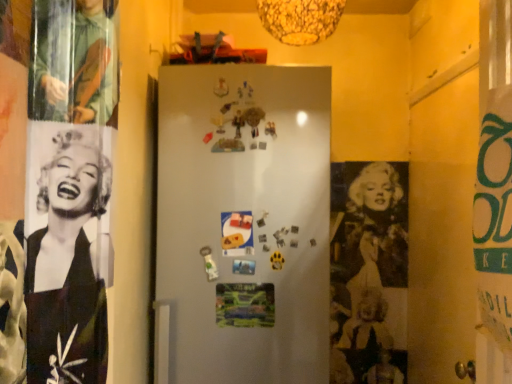
Measure the distance between matte paper poster at center, which is the 1th poster page from top to bottom, and camera.

matte paper poster at center, which is the 1th poster page from top to bottom, is 1.42 meters from camera.

Where is `matte paper poster at center, which is the 1th poster page from top to bottom`? This screenshot has width=512, height=384. matte paper poster at center, which is the 1th poster page from top to bottom is located at coordinates (237, 233).

Describe the element at coordinates (237, 233) in the screenshot. This screenshot has height=384, width=512. I see `matte paper poster at center, which is the 1th poster page from top to bottom` at that location.

Looking at this image, how much space does matte paper poster at center, arranged as the second poster page when ordered from the bottom, occupy vertically?

It is 5.87 inches.

Image resolution: width=512 pixels, height=384 pixels. Describe the element at coordinates (245, 304) in the screenshot. I see `metallic silver poster at center, positioned as the first poster page in bottom-to-top order` at that location.

Find the location of a particular element. metallic silver poster at center, positioned as the first poster page in bottom-to-top order is located at coordinates (245, 304).

The image size is (512, 384). I want to click on matte paper poster at center, which is the 1th poster page from top to bottom, so click(x=237, y=233).

Can you confirm if matte paper poster at center, arranged as the second poster page when ordered from the bottom, is positioned to the right of metallic silver poster at center, positioned as the first poster page in bottom-to-top order?

No.

Which object is closer to the camera, matte paper poster at center, which is the 1th poster page from top to bottom, or metallic silver poster at center, positioned as the first poster page in bottom-to-top order?

matte paper poster at center, which is the 1th poster page from top to bottom, is more forward.

Considering the positions of point (234, 218) and point (264, 283), is point (234, 218) closer or farther from the camera than point (264, 283)?

Point (234, 218) is farther from the camera than point (264, 283).

From the image's perspective, between matte paper poster at center, which is the 1th poster page from top to bottom, and metallic silver poster at center, which is the 2th poster page in top-to-bottom order, who is located below?

metallic silver poster at center, which is the 2th poster page in top-to-bottom order, is shown below in the image.

From a real-world perspective, which object stands above the other?

matte paper poster at center, which is the 1th poster page from top to bottom, is physically above.

Which of these two, matte paper poster at center, arranged as the second poster page when ordered from the bottom, or metallic silver poster at center, positioned as the first poster page in bottom-to-top order, is thinner?

With smaller width is metallic silver poster at center, positioned as the first poster page in bottom-to-top order.

Does matte paper poster at center, which is the 1th poster page from top to bottom, have a greater height compared to metallic silver poster at center, which is the 2th poster page in top-to-bottom order?

Indeed, matte paper poster at center, which is the 1th poster page from top to bottom, has a greater height compared to metallic silver poster at center, which is the 2th poster page in top-to-bottom order.

Is matte paper poster at center, arranged as the second poster page when ordered from the bottom, smaller than metallic silver poster at center, positioned as the first poster page in bottom-to-top order?

Correct, matte paper poster at center, arranged as the second poster page when ordered from the bottom, occupies less space than metallic silver poster at center, positioned as the first poster page in bottom-to-top order.

Is matte paper poster at center, which is the 1th poster page from top to bottom, located outside metallic silver poster at center, which is the 2th poster page in top-to-bottom order?

Yes, matte paper poster at center, which is the 1th poster page from top to bottom, is outside of metallic silver poster at center, which is the 2th poster page in top-to-bottom order.

Looking at this image, are matte paper poster at center, which is the 1th poster page from top to bottom, and metallic silver poster at center, which is the 2th poster page in top-to-bottom order, making contact?

No, matte paper poster at center, which is the 1th poster page from top to bottom, is not in contact with metallic silver poster at center, which is the 2th poster page in top-to-bottom order.

Is matte paper poster at center, which is the 1th poster page from top to bottom, oriented towards metallic silver poster at center, which is the 2th poster page in top-to-bottom order?

No, matte paper poster at center, which is the 1th poster page from top to bottom, is not aimed at metallic silver poster at center, which is the 2th poster page in top-to-bottom order.

How distant is matte paper poster at center, which is the 1th poster page from top to bottom, from metallic silver poster at center, positioned as the first poster page in bottom-to-top order?

They are 6.97 inches apart.

Where is `poster page behind the matte paper poster at center, arranged as the second poster page when ordered from the bottom`? This screenshot has height=384, width=512. poster page behind the matte paper poster at center, arranged as the second poster page when ordered from the bottom is located at coordinates (245, 304).

Consider the image. Which object is positioned more to the left, metallic silver poster at center, positioned as the first poster page in bottom-to-top order, or matte paper poster at center, which is the 1th poster page from top to bottom?

From the viewer's perspective, matte paper poster at center, which is the 1th poster page from top to bottom, appears more on the left side.

Is metallic silver poster at center, positioned as the first poster page in bottom-to-top order, closer to camera compared to matte paper poster at center, arranged as the second poster page when ordered from the bottom?

No, metallic silver poster at center, positioned as the first poster page in bottom-to-top order, is further to the viewer.

Is point (224, 308) closer or farther from the camera than point (232, 219)?

Clearly, point (224, 308) is closer to the camera than point (232, 219).

From the image's perspective, is metallic silver poster at center, positioned as the first poster page in bottom-to-top order, positioned above or below matte paper poster at center, which is the 1th poster page from top to bottom?

metallic silver poster at center, positioned as the first poster page in bottom-to-top order, is situated lower than matte paper poster at center, which is the 1th poster page from top to bottom, in the image.

From a real-world perspective, is metallic silver poster at center, which is the 2th poster page in top-to-bottom order, beneath matte paper poster at center, which is the 1th poster page from top to bottom?

Yes, from a real-world perspective, metallic silver poster at center, which is the 2th poster page in top-to-bottom order, is below matte paper poster at center, which is the 1th poster page from top to bottom.

Considering the relative sizes of metallic silver poster at center, which is the 2th poster page in top-to-bottom order, and matte paper poster at center, which is the 1th poster page from top to bottom, in the image provided, is metallic silver poster at center, which is the 2th poster page in top-to-bottom order, thinner than matte paper poster at center, which is the 1th poster page from top to bottom,?

Indeed, metallic silver poster at center, which is the 2th poster page in top-to-bottom order, has a lesser width compared to matte paper poster at center, which is the 1th poster page from top to bottom.

Is metallic silver poster at center, positioned as the first poster page in bottom-to-top order, taller or shorter than matte paper poster at center, arranged as the second poster page when ordered from the bottom?

Considering their sizes, metallic silver poster at center, positioned as the first poster page in bottom-to-top order, has less height than matte paper poster at center, arranged as the second poster page when ordered from the bottom.

Considering the sizes of objects metallic silver poster at center, which is the 2th poster page in top-to-bottom order, and matte paper poster at center, which is the 1th poster page from top to bottom, in the image provided, who is smaller, metallic silver poster at center, which is the 2th poster page in top-to-bottom order, or matte paper poster at center, which is the 1th poster page from top to bottom,?

Smaller between the two is matte paper poster at center, which is the 1th poster page from top to bottom.

Choose the correct answer: Is metallic silver poster at center, positioned as the first poster page in bottom-to-top order, inside matte paper poster at center, arranged as the second poster page when ordered from the bottom, or outside it?

metallic silver poster at center, positioned as the first poster page in bottom-to-top order, lies outside matte paper poster at center, arranged as the second poster page when ordered from the bottom.

Is metallic silver poster at center, which is the 2th poster page in top-to-bottom order, beside matte paper poster at center, which is the 1th poster page from top to bottom?

No, metallic silver poster at center, which is the 2th poster page in top-to-bottom order, is not in contact with matte paper poster at center, which is the 1th poster page from top to bottom.

Is metallic silver poster at center, which is the 2th poster page in top-to-bottom order, aimed at matte paper poster at center, which is the 1th poster page from top to bottom?

No, metallic silver poster at center, which is the 2th poster page in top-to-bottom order, does not turn towards matte paper poster at center, which is the 1th poster page from top to bottom.

How different are the orientations of metallic silver poster at center, which is the 2th poster page in top-to-bottom order, and matte paper poster at center, which is the 1th poster page from top to bottom, in degrees?

Answer: The angle between the facing direction of metallic silver poster at center, which is the 2th poster page in top-to-bottom order, and the facing direction of matte paper poster at center, which is the 1th poster page from top to bottom, is 0.000674 degrees.

The height and width of the screenshot is (384, 512). Find the location of `poster page to the left of metallic silver poster at center, positioned as the first poster page in bottom-to-top order`. poster page to the left of metallic silver poster at center, positioned as the first poster page in bottom-to-top order is located at coordinates (237, 233).

In order to click on poster page to the right of matte paper poster at center, arranged as the second poster page when ordered from the bottom in this screenshot , I will do `click(245, 304)`.

At what (x,y) coordinates should I click in order to perform the action: click on poster page above the metallic silver poster at center, which is the 2th poster page in top-to-bottom order (from the image's perspective). Please return your answer as a coordinate pair (x, y). Looking at the image, I should click on (237, 233).